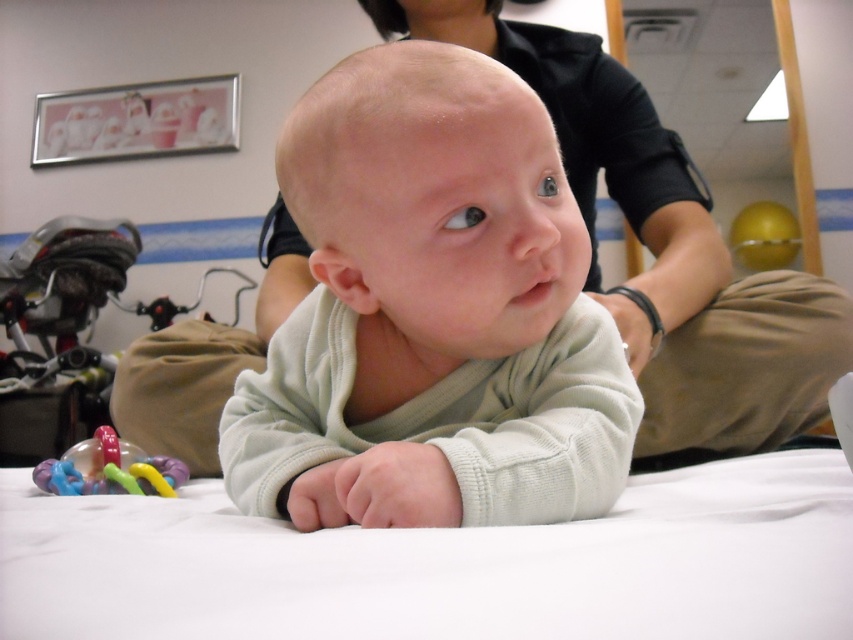
Which is above, light green fleece baby at center or white soft baby at center?

white soft baby at center

Is light green fleece baby at center closer to the viewer compared to white soft baby at center?

Yes, it is in front of white soft baby at center.

Locate an element on the screen. light green fleece baby at center is located at coordinates (431, 314).

Is light green fleece baby at center shorter than rubberized plastic teething ring at lower left?

No, light green fleece baby at center is not shorter than rubberized plastic teething ring at lower left.

Between point (350, 444) and point (140, 465), which one is positioned in front?

Point (350, 444) is in front.

This screenshot has height=640, width=853. Describe the element at coordinates (431, 314) in the screenshot. I see `light green fleece baby at center` at that location.

You are a GUI agent. You are given a task and a screenshot of the screen. Output one action in this format:
    pyautogui.click(x=<x>, y=<y>)
    Task: Click on the light green fleece baby at center
    The image size is (853, 640).
    Given the screenshot: What is the action you would take?
    pyautogui.click(x=431, y=314)

Who is more distant from viewer, (686,376) or (76,483)?

Point (686,376)

Is point (132, 435) positioned behind point (173, 481)?

That is True.

Does point (717, 384) come in front of point (163, 458)?

No, it is behind (163, 458).

You are a GUI agent. You are given a task and a screenshot of the screen. Output one action in this format:
    pyautogui.click(x=<x>, y=<y>)
    Task: Click on the white soft baby at center
    Image resolution: width=853 pixels, height=640 pixels.
    Given the screenshot: What is the action you would take?
    pyautogui.click(x=662, y=248)